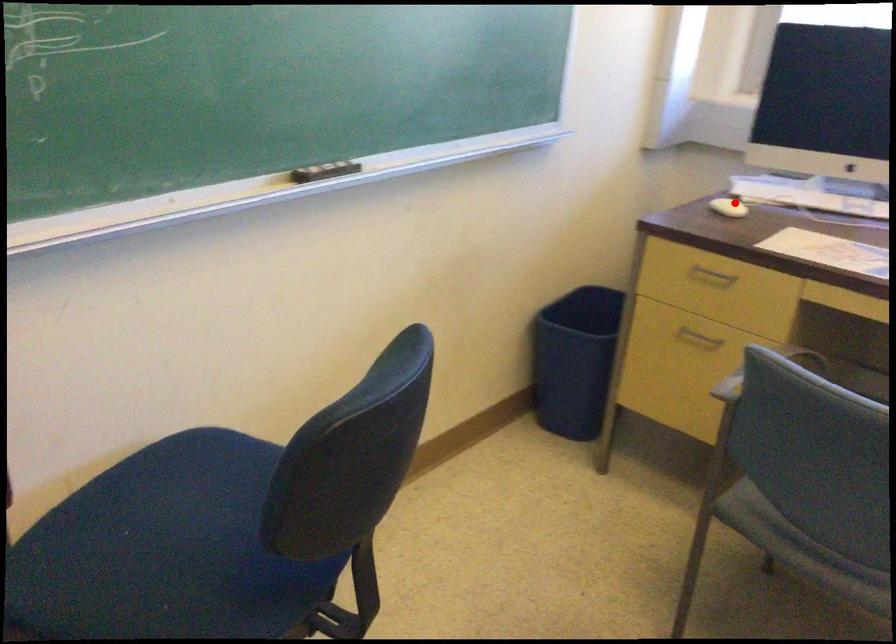
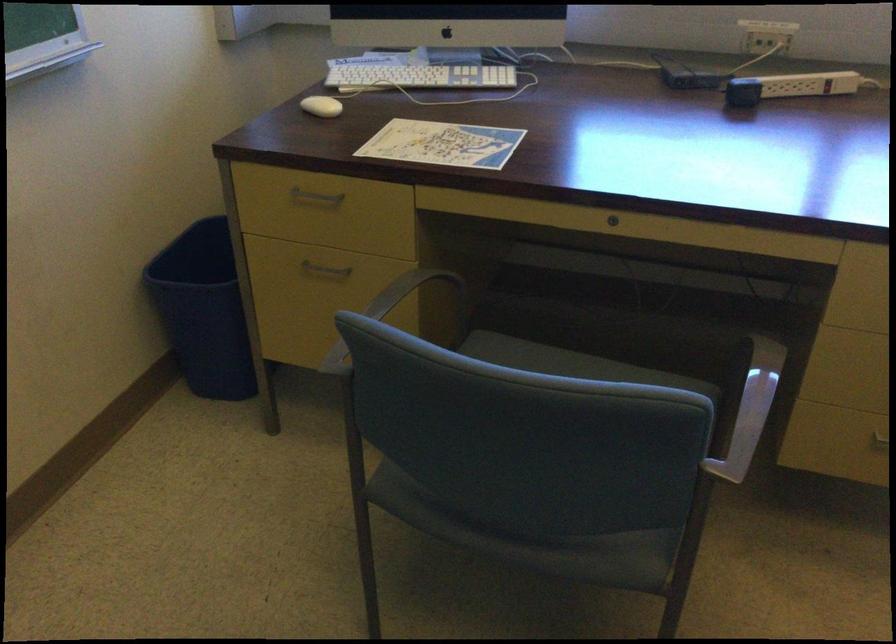
Locate, in the second image, the point that corresponds to the highlighted location in the first image.

(321, 106)